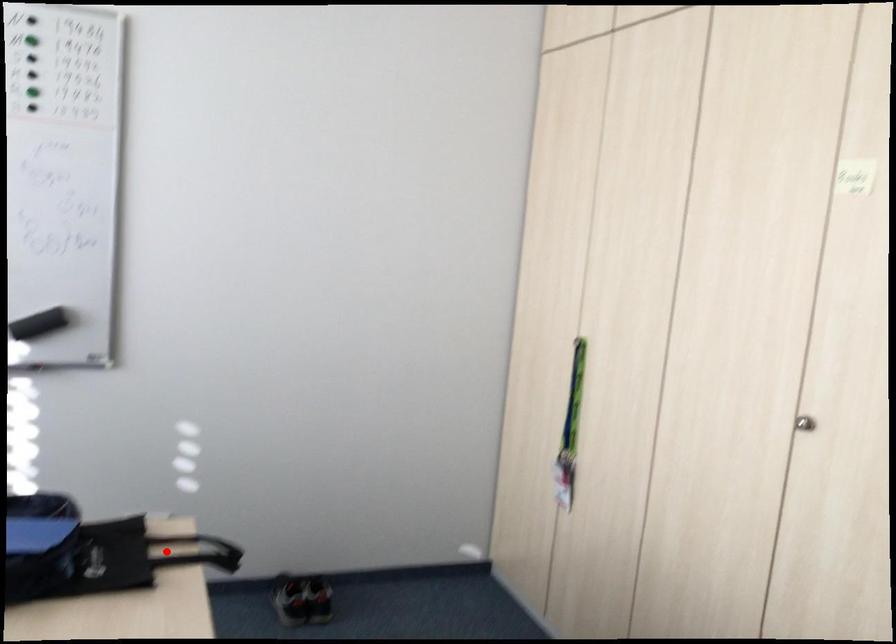
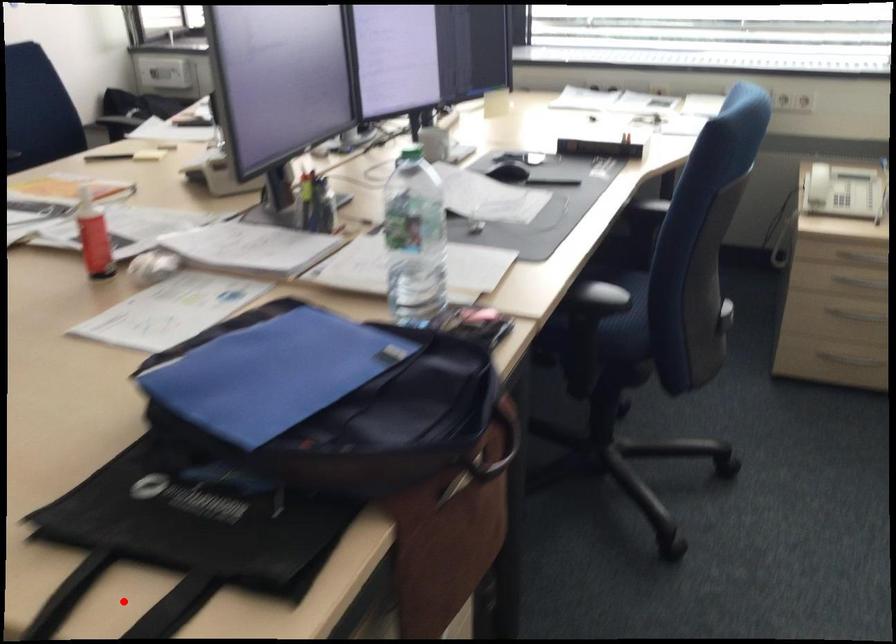
I am providing you with two images of the same scene from different viewpoints. A red point is marked on the first image and another point is marked on the second image. Does the point marked in image1 correspond to the same location as the one in image2?

Yes